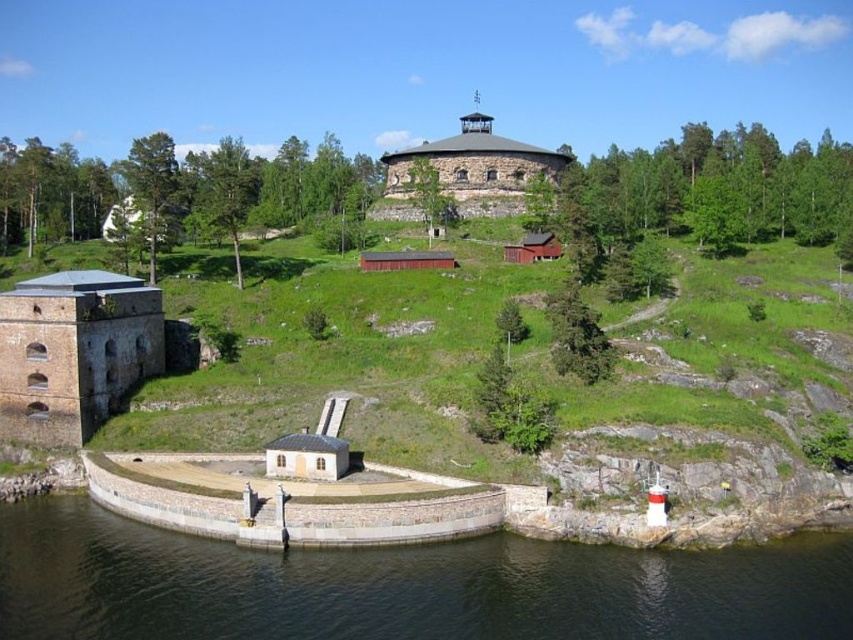
You are standing at the fortress and looking towards the curved stone wall in the foreground. There is a point marked at coordinates (402,586). What is located at this point?

The point at coordinates (402,586) indicates transparent water at lower left.

You are standing at the entrance of the fortress and want to cross to the other side. The transparent water at lower left and the brown stone fort at lower left are in your path. Which one do you need to go around because it might block your direct path?

The transparent water at lower left might be wider than the brown stone fort at lower left, so you might need to go around the transparent water at lower left since it could block your path more significantly.

You are a tourist standing at the base of the stone tower at center. You want to take a photo of the transparent water at lower left. Which direction should you face to capture it in your view?

The transparent water at lower left is located below the stone tower at center, so you should face downward from the stone tower at center to capture it in your view.